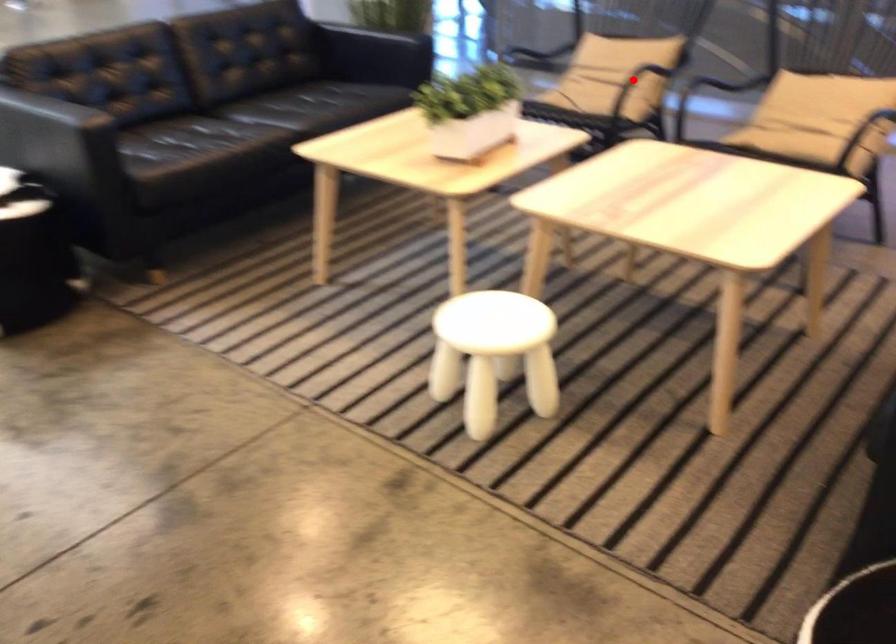
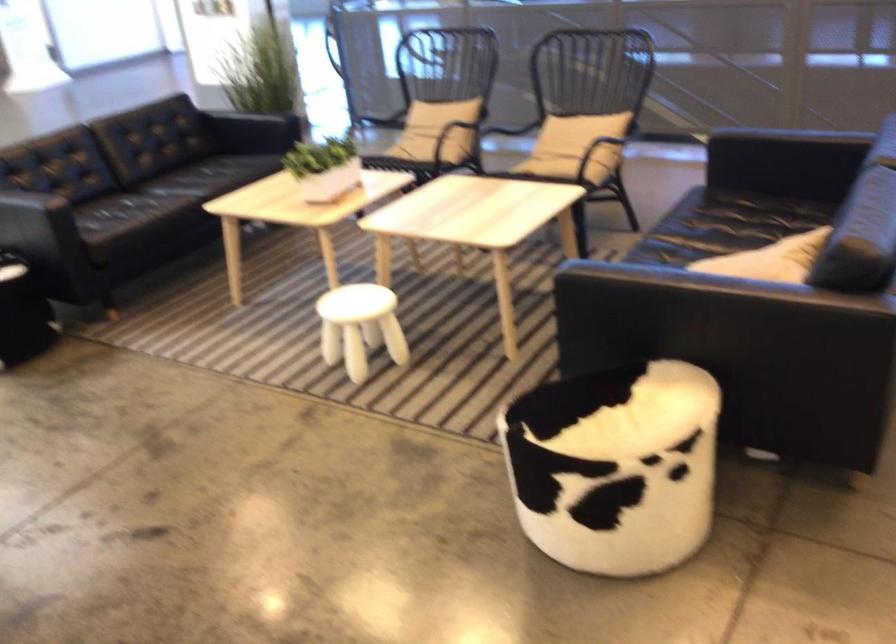
The point at the highlighted location is marked in the first image. Where is the corresponding point in the second image?

(440, 128)